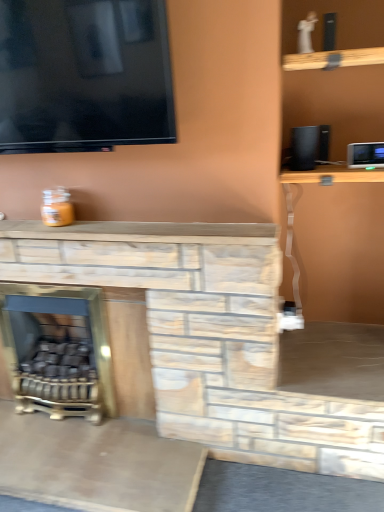
Question: Considering the positions of point (14, 390) and point (306, 162), is point (14, 390) closer or farther from the camera than point (306, 162)?

Choices:
 (A) closer
 (B) farther

Answer: (B)

Question: Is gold metallic fireplace at lower left inside or outside of black matte speaker at upper right?

Choices:
 (A) outside
 (B) inside

Answer: (A)

Question: Based on their relative distances, which object is farther from the gold metallic fireplace at lower left?

Choices:
 (A) black matte speaker at upper right
 (B) white plastic appliance at upper right

Answer: (B)

Question: Which object is positioned farthest from the black matte speaker at upper right?

Choices:
 (A) white plastic appliance at upper right
 (B) gold metallic fireplace at lower left

Answer: (B)